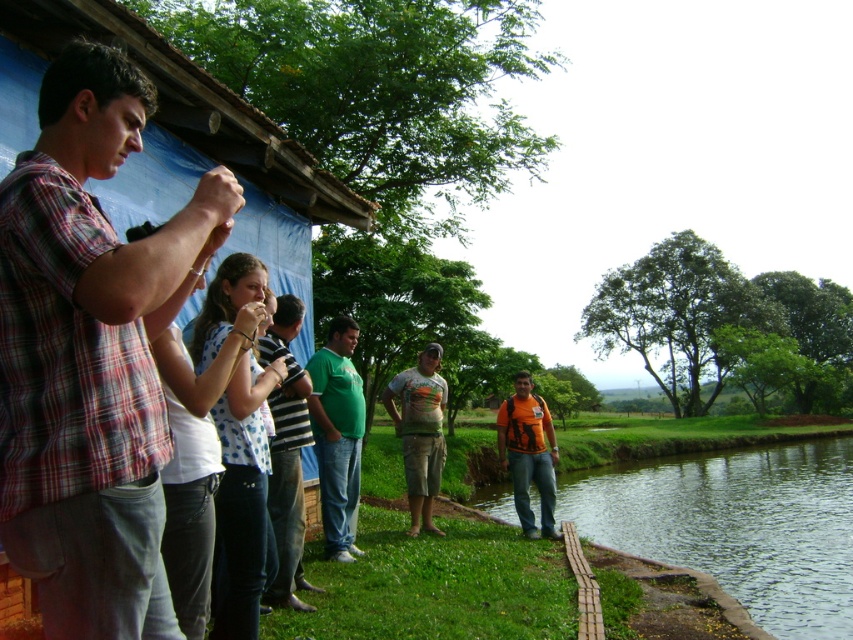
Question: Which object is farther from the camera taking this photo?

Choices:
 (A) plaid fabric shirt at left
 (B) clear water at lower right
 (C) camouflage-patterned shorts at center
 (D) striped cotton shirt at center

Answer: (C)

Question: Does camouflage-patterned shorts at center lie behind orange fabric backpack at center?

Choices:
 (A) no
 (B) yes

Answer: (A)

Question: Based on their relative distances, which object is farther from the striped cotton shirt at center?

Choices:
 (A) camouflage-patterned shorts at center
 (B) green matte shirt at center
 (C) clear water at lower right
 (D) orange fabric backpack at center

Answer: (C)

Question: Does clear water at lower right appear on the right side of striped cotton shirt at center?

Choices:
 (A) yes
 (B) no

Answer: (A)

Question: Which object is the farthest from the orange fabric backpack at center?

Choices:
 (A) camouflage-patterned shorts at center
 (B) striped cotton shirt at center

Answer: (B)

Question: Does green matte shirt at center come in front of camouflage-patterned shorts at center?

Choices:
 (A) yes
 (B) no

Answer: (A)